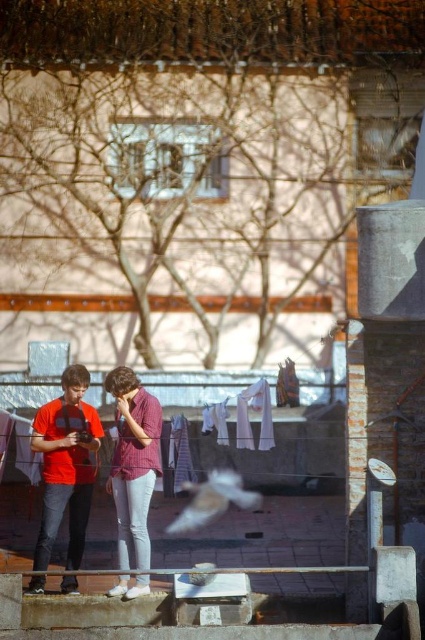
In the scene shown: Who is shorter, matte red t-shirt at left or white feathered bird at center?

white feathered bird at center is shorter.

Who is more forward, [48,451] or [223,472]?

Point [48,451]

Find the location of a particular element. The height and width of the screenshot is (640, 425). matte red t-shirt at left is located at coordinates (65, 465).

Does matte red shirt at center appear on the left side of white feathered bird at center?

Yes, matte red shirt at center is to the left of white feathered bird at center.

You are a GUI agent. You are given a task and a screenshot of the screen. Output one action in this format:
    pyautogui.click(x=<x>, y=<y>)
    Task: Click on the matte red shirt at center
    The width and height of the screenshot is (425, 640).
    Given the screenshot: What is the action you would take?
    pyautogui.click(x=133, y=461)

What do you see at coordinates (133, 461) in the screenshot? I see `matte red shirt at center` at bounding box center [133, 461].

This screenshot has height=640, width=425. What are the coordinates of `matte red shirt at center` in the screenshot? It's located at (133, 461).

Image resolution: width=425 pixels, height=640 pixels. Describe the element at coordinates (65, 465) in the screenshot. I see `matte red t-shirt at left` at that location.

Who is positioned more to the right, matte red t-shirt at left or matte red shirt at center?

matte red shirt at center is more to the right.

Who is more forward, (82,388) or (144,435)?

Positioned in front is point (144,435).

Image resolution: width=425 pixels, height=640 pixels. In order to click on matte red t-shirt at left in this screenshot , I will do `click(65, 465)`.